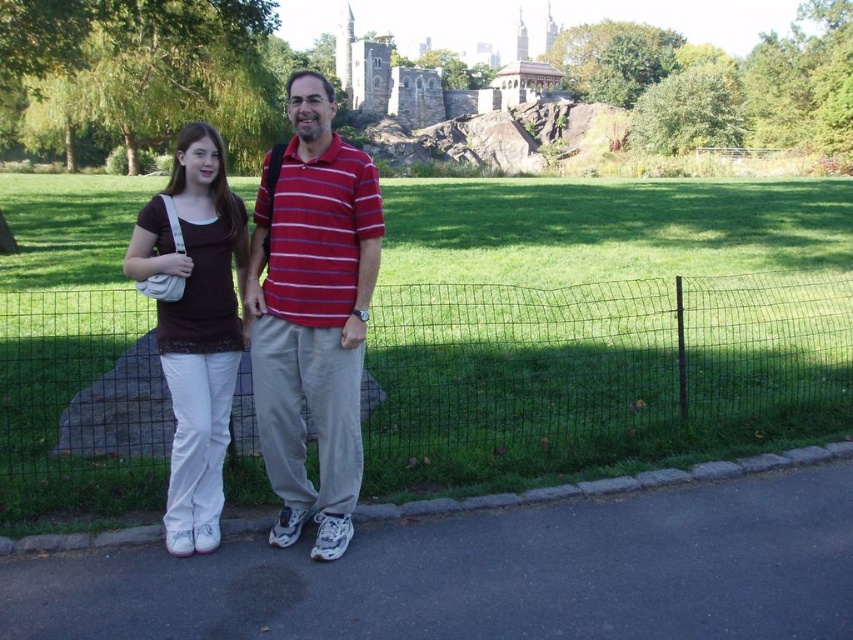
Question: Among these objects, which one is farthest from the camera?

Choices:
 (A) matte red striped polo shirt at center
 (B) matte white pants at center
 (C) wire mesh fence at center

Answer: (C)

Question: Can you confirm if wire mesh fence at center is positioned to the right of matte white pants at center?

Choices:
 (A) no
 (B) yes

Answer: (B)

Question: Which is nearer to the matte white pants at center?

Choices:
 (A) wire mesh fence at center
 (B) matte red striped polo shirt at center

Answer: (B)

Question: Is wire mesh fence at center smaller than matte white pants at center?

Choices:
 (A) no
 (B) yes

Answer: (A)

Question: Estimate the real-world distances between objects in this image. Which object is closer to the matte white pants at center?

Choices:
 (A) matte red striped polo shirt at center
 (B) wire mesh fence at center

Answer: (A)

Question: Is wire mesh fence at center to the left of matte white pants at center from the viewer's perspective?

Choices:
 (A) yes
 (B) no

Answer: (B)